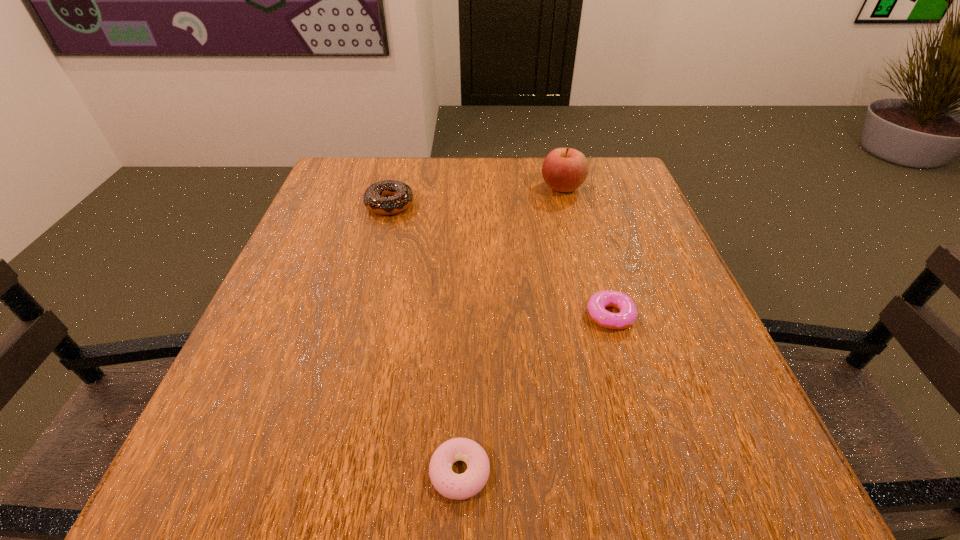
This screenshot has width=960, height=540. I want to click on free space located 0.200m on the right of the third object from right to left, so click(637, 472).

In order to click on apple located at the far edge in this screenshot , I will do `click(564, 169)`.

Identify the location of doughnut located at the far edge. (388, 197).

Identify the location of object that is at the near edge. (462, 486).

The height and width of the screenshot is (540, 960). In order to click on object present at the left edge in this screenshot , I will do `click(388, 197)`.

This screenshot has width=960, height=540. Identify the location of apple located in the right edge section of the desktop. (564, 169).

You are a GUI agent. You are given a task and a screenshot of the screen. Output one action in this format:
    pyautogui.click(x=<x>, y=<y>)
    Task: Click on the doughnut located in the right edge section of the desktop
    The image size is (960, 540).
    Given the screenshot: What is the action you would take?
    pyautogui.click(x=597, y=303)

I want to click on object present at the far left corner, so click(x=388, y=197).

Locate an element on the screen. object that is at the far right corner is located at coordinates (564, 169).

What are the coordinates of `free space at the far edge` in the screenshot? It's located at (483, 199).